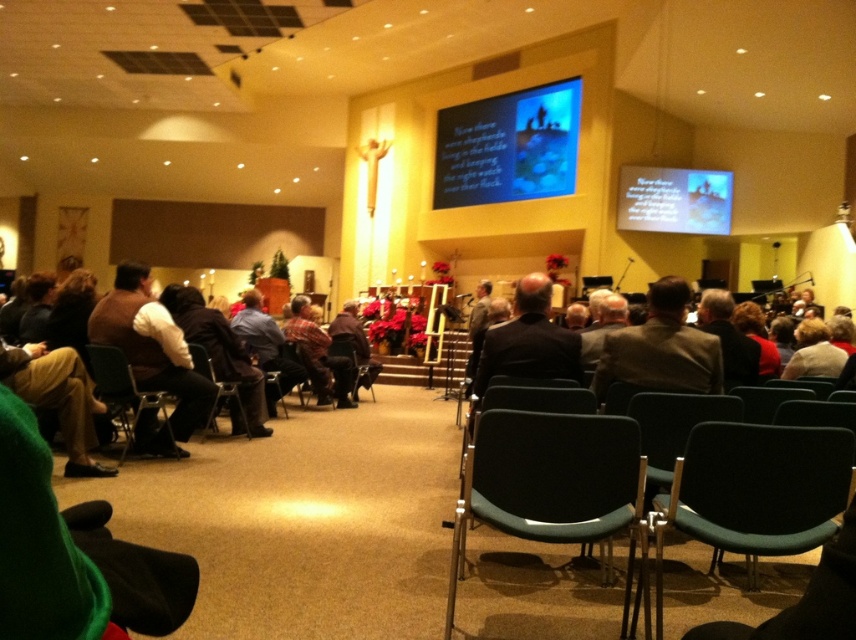
Can you confirm if dark brown leather jacket at center is thinner than green plastic chair at lower right?

No, dark brown leather jacket at center is not thinner than green plastic chair at lower right.

Between point (205, 326) and point (776, 390), which one is positioned behind?

Point (205, 326)

The height and width of the screenshot is (640, 856). I want to click on dark brown leather jacket at center, so click(220, 355).

Does brown sweater at left appear under plaid shirt at center?

No.

Is brown sweater at left smaller than plaid shirt at center?

Correct, brown sweater at left occupies less space than plaid shirt at center.

Does point (103, 330) lie in front of point (311, 342)?

Yes, it is.

You are a GUI agent. You are given a task and a screenshot of the screen. Output one action in this format:
    pyautogui.click(x=<x>, y=<y>)
    Task: Click on the brown sweater at left
    Image resolution: width=856 pixels, height=640 pixels.
    Given the screenshot: What is the action you would take?
    pyautogui.click(x=152, y=358)

Can you confirm if green fabric chair at lower right is taller than dark brown leather jacket at center?

No.

Consider the image. Is green fabric chair at lower right bigger than dark brown leather jacket at center?

No.

Find the location of a particular element. green fabric chair at lower right is located at coordinates (753, 492).